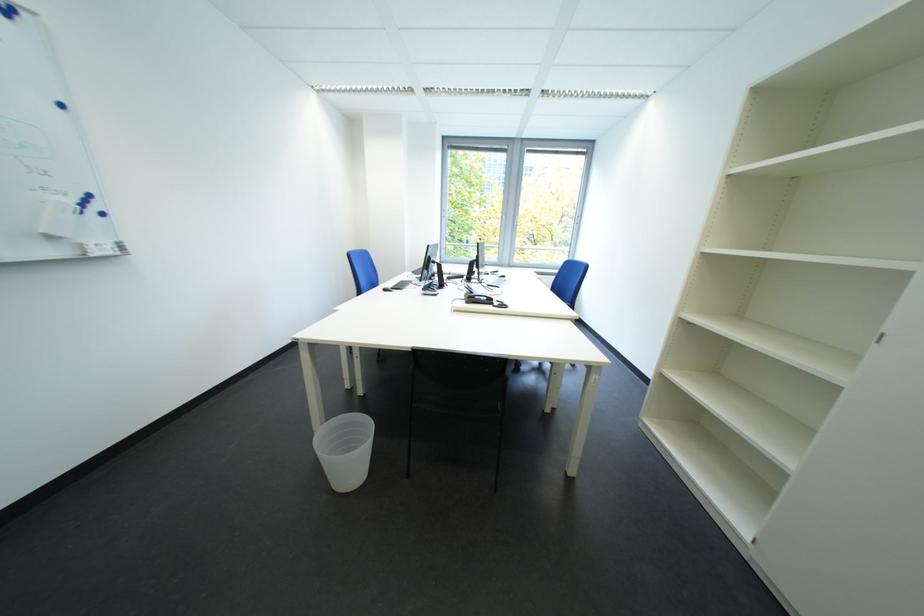
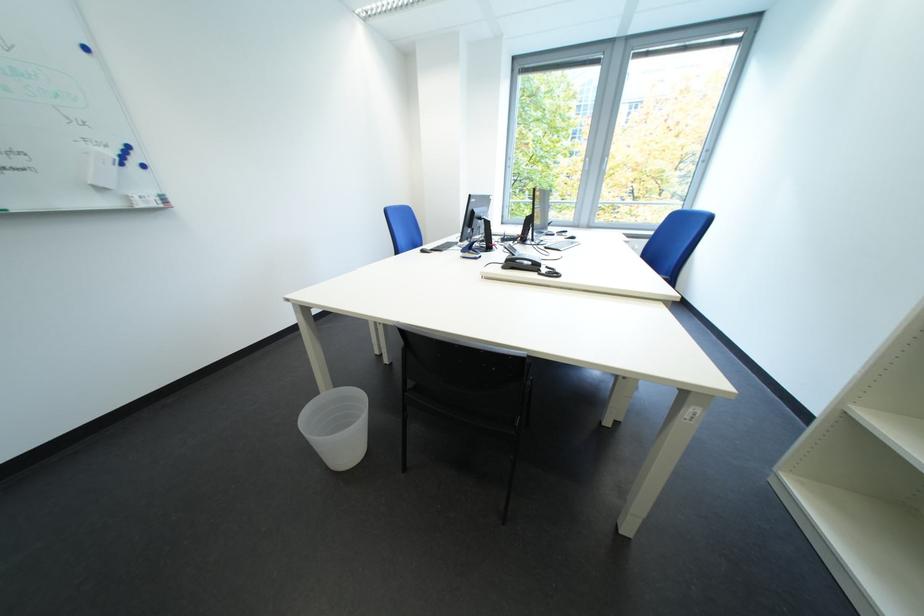
Question: The camera is either moving clockwise (left) or counter-clockwise (right) around the object. The first image is from the beginning of the video and the second image is from the end. Is the camera moving left or right when shooting the video?

Choices:
 (A) Left
 (B) Right

Answer: (B)